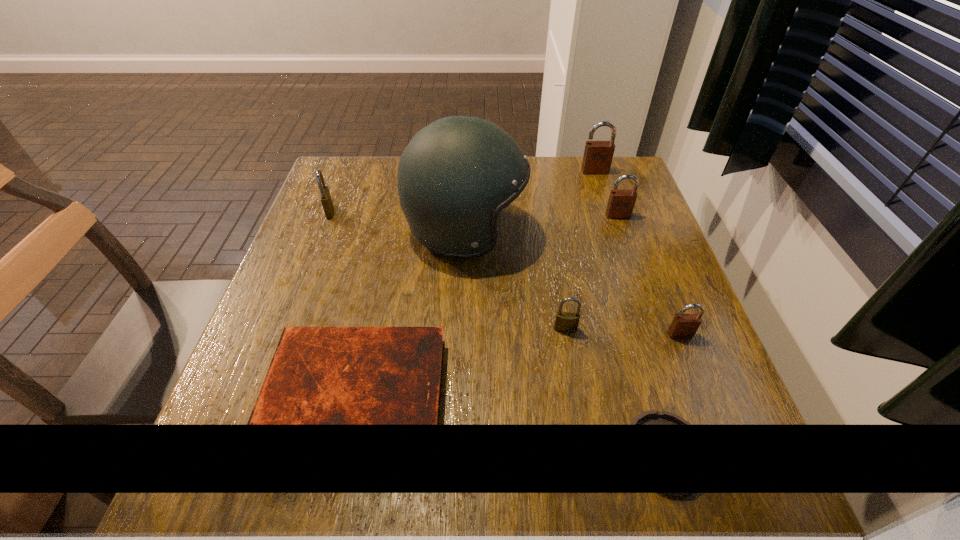
Find the location of `Bible`. Bible is located at coordinates (318, 375).

Locate an element on the screen. The height and width of the screenshot is (540, 960). the shortest object is located at coordinates (652, 417).

Where is `gray ashtray`? This screenshot has height=540, width=960. gray ashtray is located at coordinates (652, 417).

This screenshot has width=960, height=540. I want to click on vacant space located 0.300m at the face opening of the tallest object, so click(x=650, y=232).

Identify the location of free space located 0.230m on the front-facing side of the farthest object. (613, 227).

Where is `free space located 0.320m on the front of the leftmost object`? Image resolution: width=960 pixels, height=540 pixels. free space located 0.320m on the front of the leftmost object is located at coordinates (288, 320).

The width and height of the screenshot is (960, 540). I want to click on vacant space located on the front-facing side of the second smallest brown padlock, so click(660, 336).

The image size is (960, 540). Find the location of `blank space located on the left of the right brass padlock`. blank space located on the left of the right brass padlock is located at coordinates (445, 329).

Image resolution: width=960 pixels, height=540 pixels. I want to click on vacant space located 0.260m on the front-facing side of the nearest brown padlock, so click(736, 481).

Identify the location of free space located on the left of the ashtray. The height and width of the screenshot is (540, 960). (441, 451).